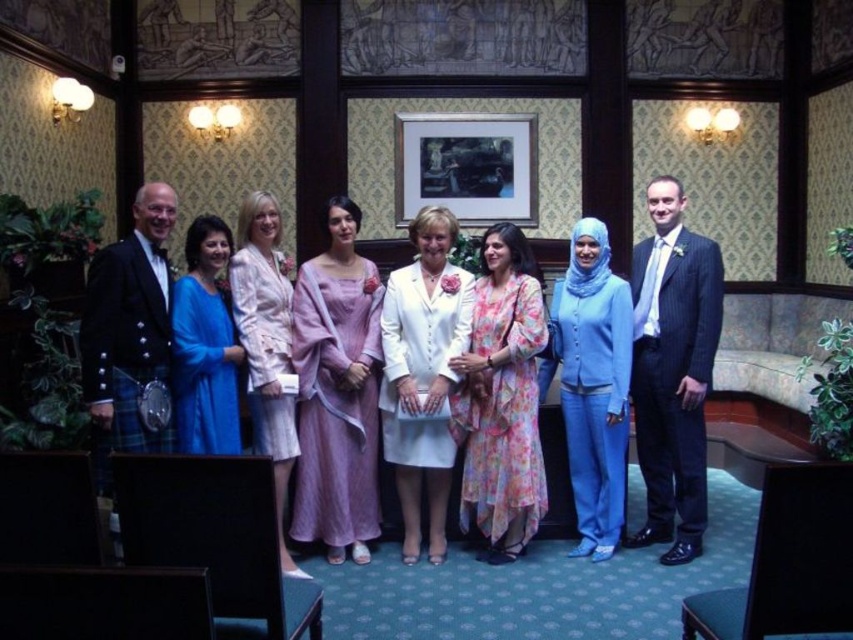
Question: Among these objects, which one is farthest from the camera?

Choices:
 (A) matte white dress at center
 (B) white satin dress at center

Answer: (B)

Question: Does matte blue dress at center have a lesser width compared to silky pink dress at center?

Choices:
 (A) no
 (B) yes

Answer: (B)

Question: Is matte white dress at center further to the viewer compared to matte blue dress at center?

Choices:
 (A) yes
 (B) no

Answer: (A)

Question: Which object is the farthest from the matte black kilt at left?

Choices:
 (A) dark blue pinstripe suit at right
 (B) white satin dress at center

Answer: (A)

Question: Considering the real-world distances, which object is farthest from the purple silk dress at center?

Choices:
 (A) matte black kilt at left
 (B) matte blue dress at center
 (C) matte blue suit at center
 (D) dark blue pinstripe suit at right

Answer: (D)

Question: Is light pink satin dress at center bigger than silky pink dress at center?

Choices:
 (A) no
 (B) yes

Answer: (B)